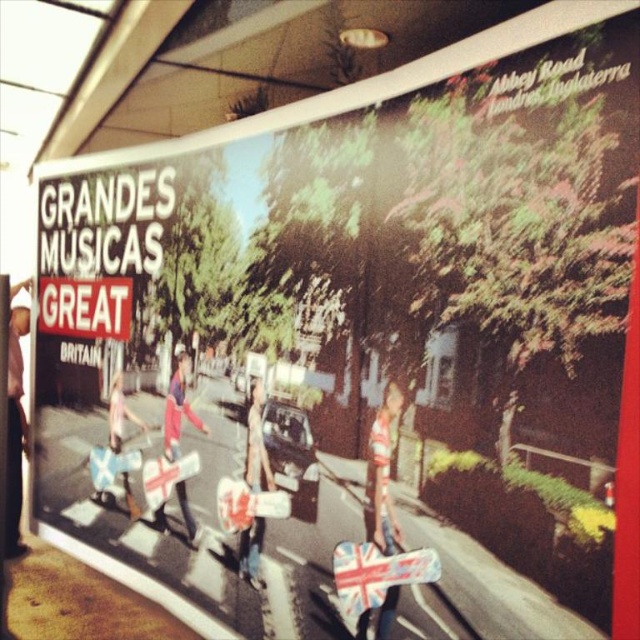
You are a delivery person who needs to place a package between the matte black pants at left and the denim jacket at center. The package requires a space of 6 feet. Can you fit it there?

The distance between the matte black pants at left and the denim jacket at center is 6.59 feet, which is more than enough to accommodate the 6 feet required for the package. Yes, the package can be placed there.